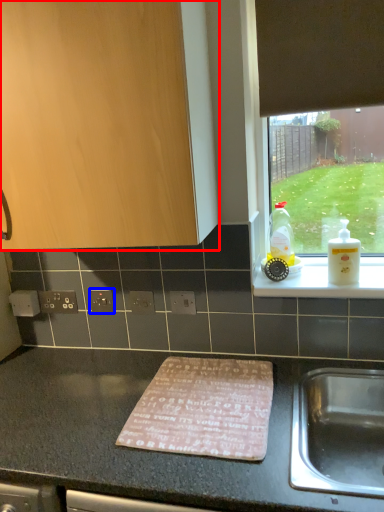
Question: Which point is further to the camera, cabinetry (highlighted by a red box) or electric outlet (highlighted by a blue box)?

Choices:
 (A) cabinetry
 (B) electric outlet

Answer: (B)